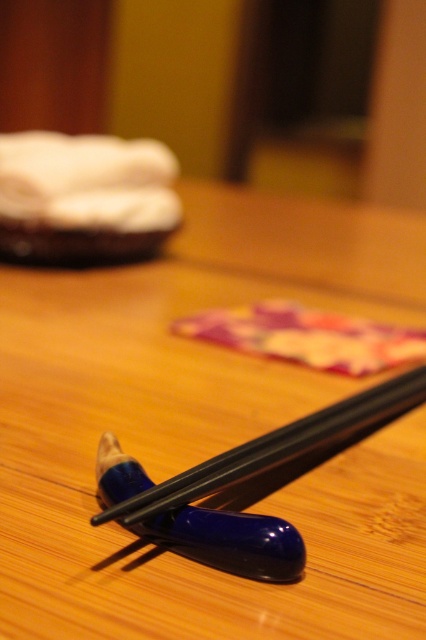
Is black glossy chopsticks at center to the right of blue glossy chopsticks at center from the viewer's perspective?

Incorrect, black glossy chopsticks at center is not on the right side of blue glossy chopsticks at center.

Can you confirm if black glossy chopsticks at center is smaller than blue glossy chopsticks at center?

No, black glossy chopsticks at center is not smaller than blue glossy chopsticks at center.

Does point (183, 195) come behind point (158, 497)?

Yes, point (183, 195) is behind point (158, 497).

Where is `black glossy chopsticks at center`? black glossy chopsticks at center is located at coordinates (207, 428).

Between point (189, 326) and point (287, 449), which one is positioned in front?

Positioned in front is point (287, 449).

Is point (235, 308) farther from camera compared to point (307, 432)?

Yes.

Find the location of a particular element. This screenshot has width=426, height=640. floral fabric at center is located at coordinates (307, 337).

Can you confirm if black glossy chopsticks at center is positioned to the right of floral fabric at center?

Incorrect, black glossy chopsticks at center is not on the right side of floral fabric at center.

You are a GUI agent. You are given a task and a screenshot of the screen. Output one action in this format:
    pyautogui.click(x=<x>, y=<y>)
    Task: Click on the black glossy chopsticks at center
    
    Given the screenshot: What is the action you would take?
    pyautogui.click(x=207, y=428)

Locate an element on the screen. black glossy chopsticks at center is located at coordinates (207, 428).